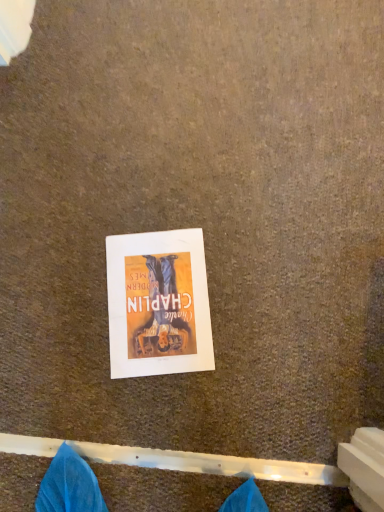
In order to face matte paper poster at center, should I rotate leftwards or rightwards?

A 4.417 degree turn to the left will do.

Describe the element at coordinates (158, 304) in the screenshot. I see `matte paper poster at center` at that location.

What are the coordinates of `matte paper poster at center` in the screenshot? It's located at (158, 304).

In the scene shown: Measure the distance between point [191,319] and camera.

They are 34.49 inches apart.

Measure the distance between matte paper poster at center and camera.

matte paper poster at center is 33.62 inches from camera.

At what (x,y) coordinates should I click in order to perform the action: click on matte paper poster at center. Please return your answer as a coordinate pair (x, y). The image size is (384, 512). Looking at the image, I should click on (158, 304).